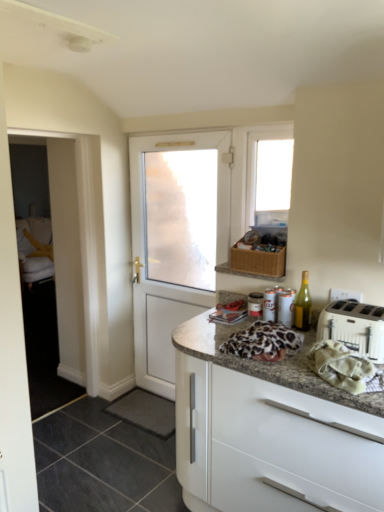
Locate an element on the screen. The width and height of the screenshot is (384, 512). free point below black rubber mat at lower center, the second tile in the front-to-back sequence (from a real-world perspective) is located at coordinates (143, 407).